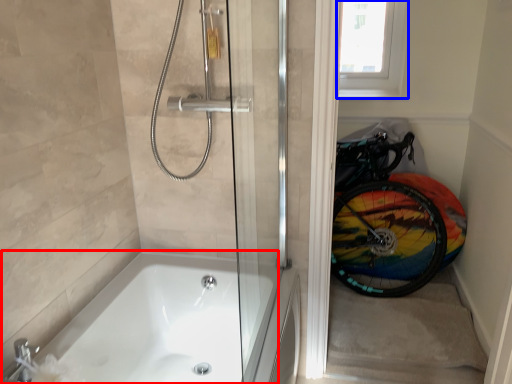
Question: Which of the following is the closest to the observer, bathtub (highlighted by a red box) or window screen (highlighted by a blue box)?

Choices:
 (A) bathtub
 (B) window screen

Answer: (A)